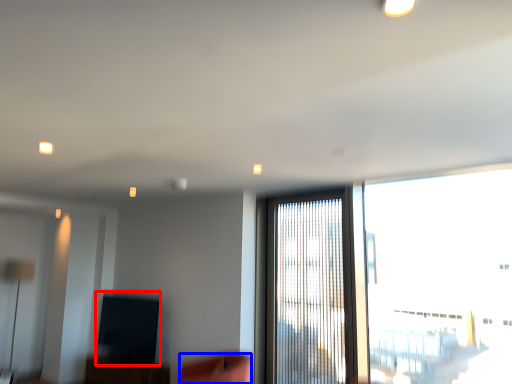
Question: Which point is further to the camera, window screen (highlighted by a red box) or swivel chair (highlighted by a blue box)?

Choices:
 (A) window screen
 (B) swivel chair

Answer: (A)